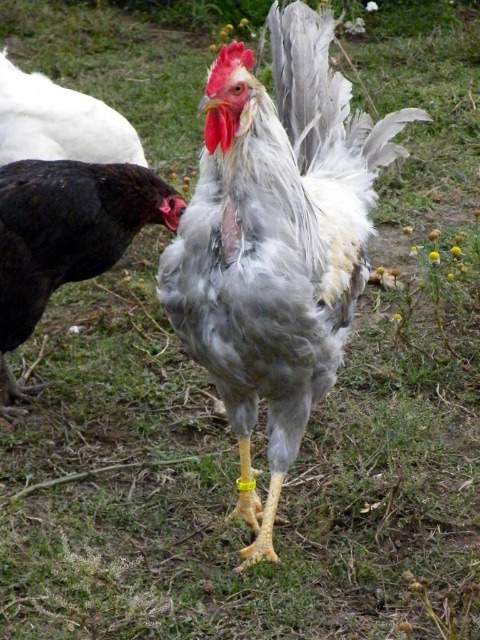
Can you confirm if white feathered rooster at center is bigger than white feathered chicken at upper left?

Indeed, white feathered rooster at center has a larger size compared to white feathered chicken at upper left.

Who is shorter, white feathered rooster at center or white feathered chicken at upper left?

With less height is white feathered chicken at upper left.

Is point (192, 321) less distant than point (29, 77)?

Yes, it is.

You are a GUI agent. You are given a task and a screenshot of the screen. Output one action in this format:
    pyautogui.click(x=<x>, y=<y>)
    Task: Click on the white feathered rooster at center
    
    Given the screenshot: What is the action you would take?
    pyautogui.click(x=276, y=241)

Which is in front, point (12, 336) or point (4, 93)?

Point (12, 336) is in front.

Between point (144, 216) and point (24, 122), which one is positioned behind?

Point (24, 122)

The width and height of the screenshot is (480, 640). Find the location of `shiny black chicken at left`. shiny black chicken at left is located at coordinates (66, 237).

Which is more to the left, white feathered rooster at center or shiny black chicken at left?

shiny black chicken at left

Is white feathered rooster at center wider than shiny black chicken at left?

Yes.

Which is in front, point (223, 369) or point (24, 168)?

Point (223, 369)

Find the location of `white feathered rooster at center`. white feathered rooster at center is located at coordinates (276, 241).